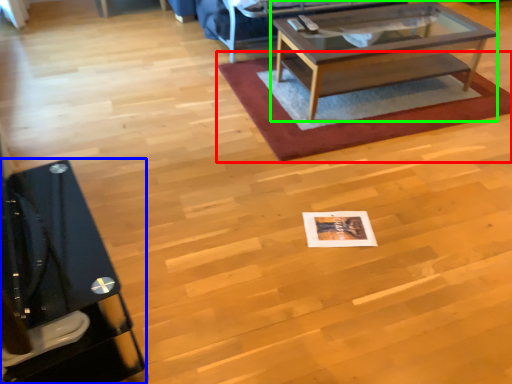
Question: Which object is positioned closest to mat (highlighted by a red box)? Select from desk (highlighted by a blue box) and coffee table (highlighted by a green box).

Choices:
 (A) desk
 (B) coffee table

Answer: (B)